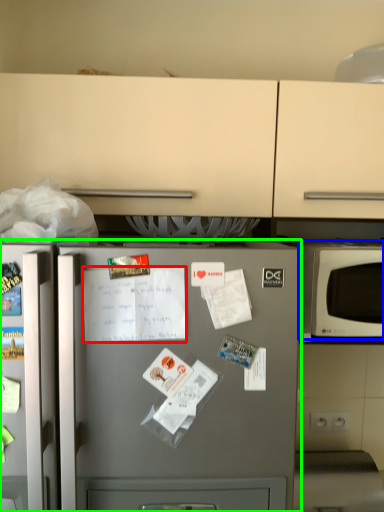
Question: Which object is positioned farthest from receipt (highlighted by a red box)? Select from microwave oven (highlighted by a blue box) and refrigerator (highlighted by a green box).

Choices:
 (A) microwave oven
 (B) refrigerator

Answer: (A)